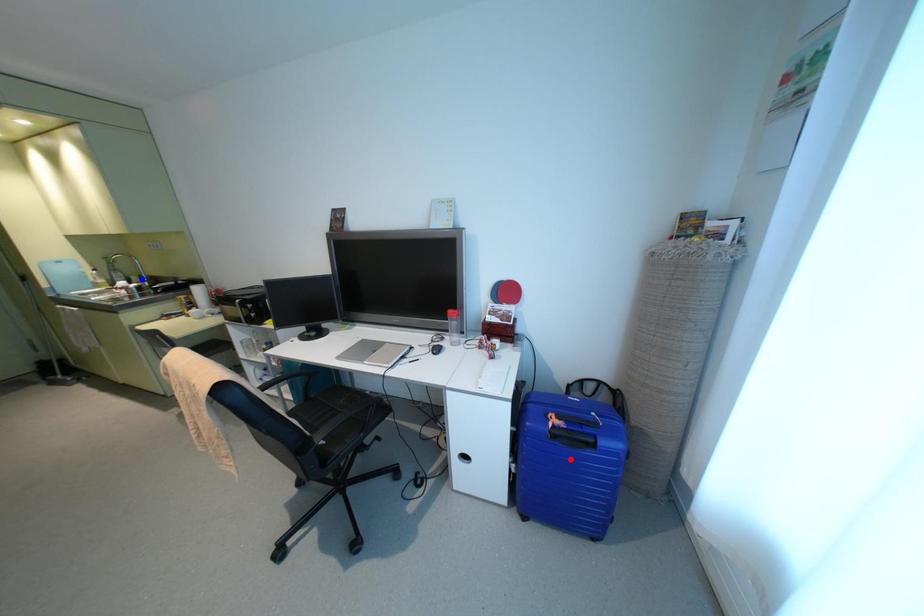
Question: Which of the two points in the image is closer to the camera?

Choices:
 (A) Blue point is closer.
 (B) Red point is closer.

Answer: (B)